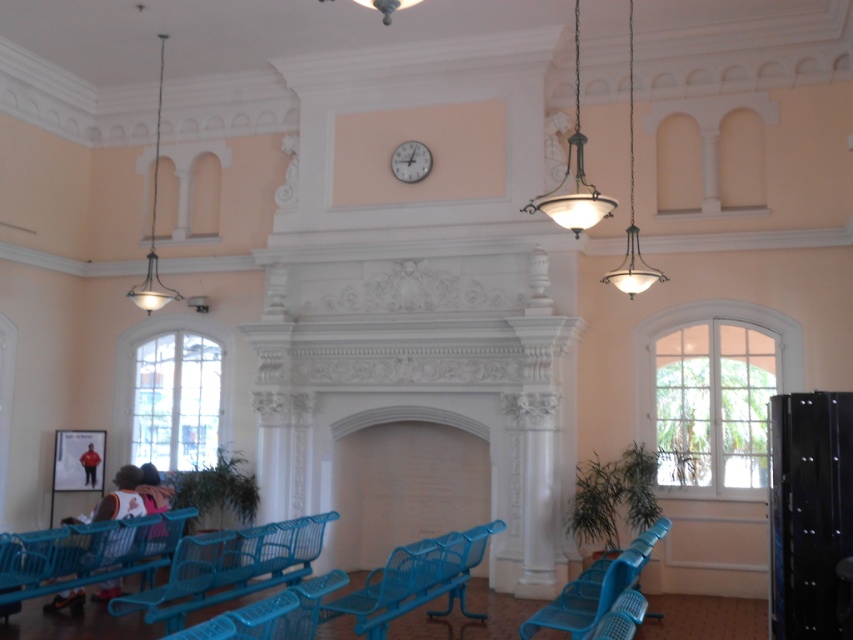
Is metallic blue bench at center closer to camera compared to blue plastic chair at lower right?

No.

Between metallic blue bench at center and blue plastic chair at lower right, which one is positioned higher?

blue plastic chair at lower right

Is point (393, 561) in front of point (639, 572)?

Yes, it is in front of point (639, 572).

The width and height of the screenshot is (853, 640). Identify the location of metallic blue bench at center. (415, 580).

Based on the photo, is blue plastic bench at lower left further to camera compared to green glass pendant light at upper center?

No.

Between blue plastic bench at lower left and green glass pendant light at upper center, which one has less height?

green glass pendant light at upper center

Image resolution: width=853 pixels, height=640 pixels. Identify the location of blue plastic bench at lower left. (86, 554).

Does metallic blue bench at center lie behind metallic pendant light at upper left?

No, it is in front of metallic pendant light at upper left.

The width and height of the screenshot is (853, 640). Find the location of `metallic blue bench at center`. metallic blue bench at center is located at coordinates (415, 580).

The height and width of the screenshot is (640, 853). Find the location of `metallic blue bench at center`. metallic blue bench at center is located at coordinates (415, 580).